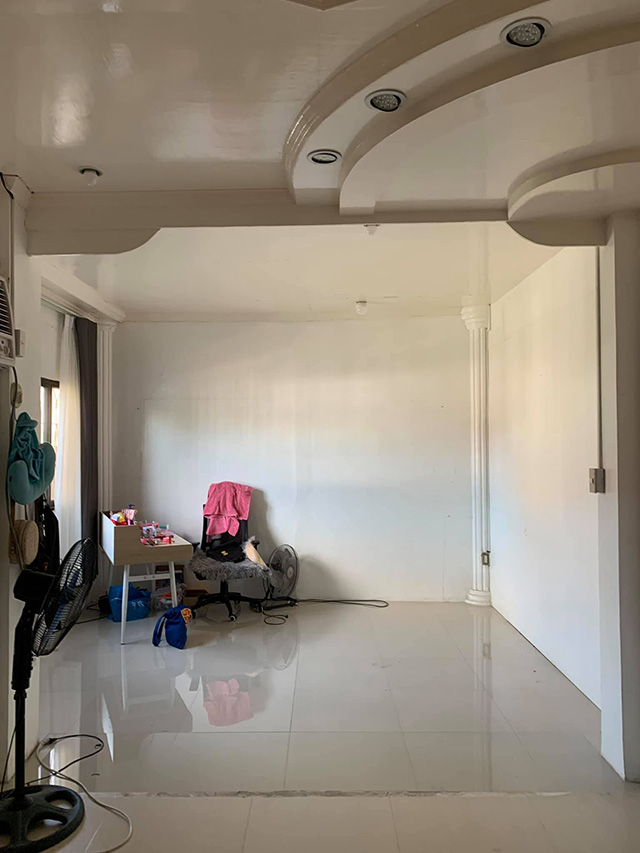
This screenshot has width=640, height=853. In order to click on wheels on chair in this screenshot , I will do `click(230, 618)`, `click(194, 612)`, `click(237, 602)`.